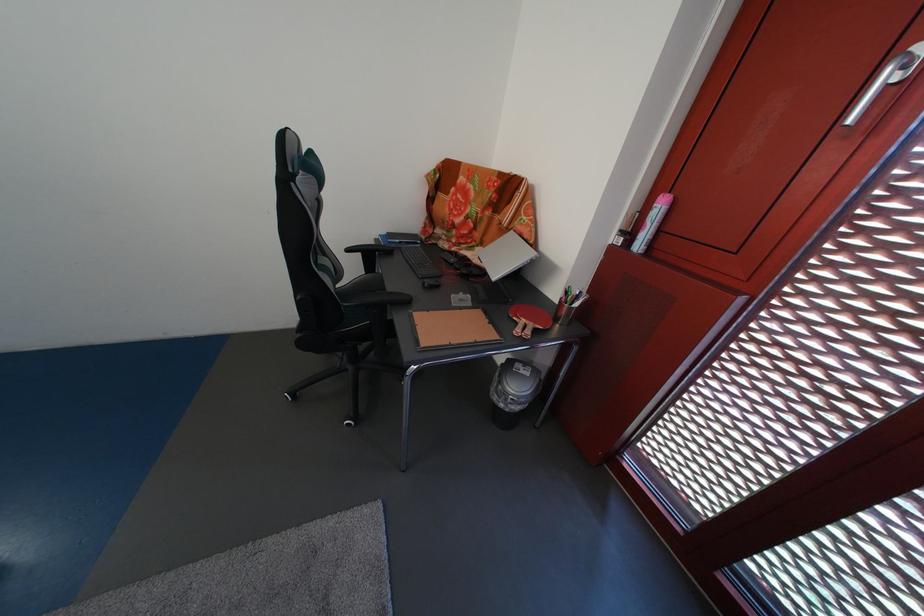
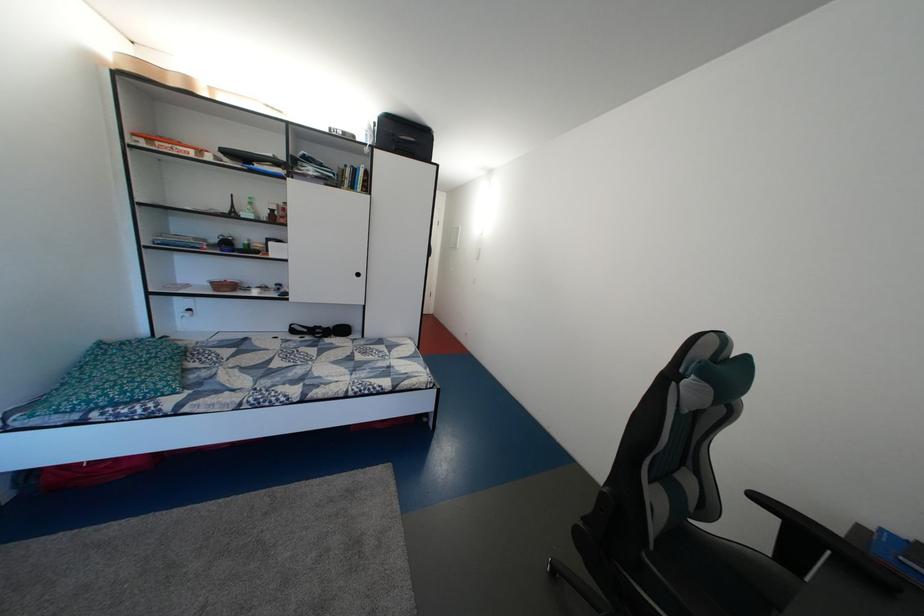
Find the pixel in the second image that matches (x=360, y=257) in the first image.

(768, 504)